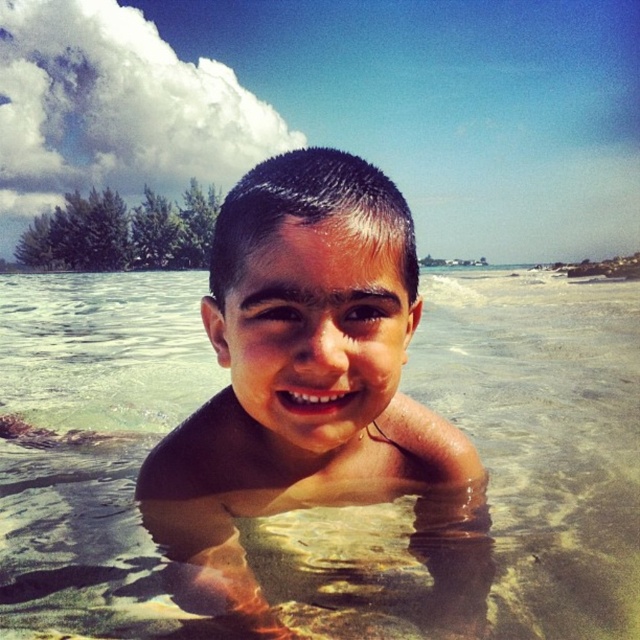
You are a photographer at the beach and want to capture the clear water at center and the smooth skin child at center in a single shot. Based on their sizes, which one would appear bigger in the photo?

The clear water at center would appear bigger in the photo because it has a larger size compared to the smooth skin child at center according to the description.

You are a lifeguard on duty and notice the clear water at center and the smooth skin child at center. Based on their positions, which object is higher in the image?

The clear water at center is taller than the smooth skin child at center, so the clear water at center is higher in the image.